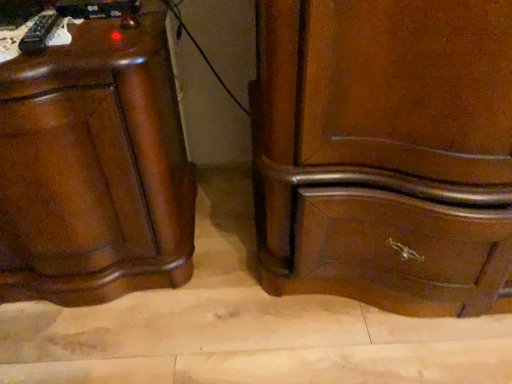
This screenshot has width=512, height=384. What do you see at coordinates (94, 169) in the screenshot?
I see `shiny brown wood chest of drawers at left` at bounding box center [94, 169].

Identify the location of shiny brown wood chest of drawers at left. The width and height of the screenshot is (512, 384). (94, 169).

Find the location of a particular element. This screenshot has height=384, width=512. shiny brown wood chest of drawers at left is located at coordinates (94, 169).